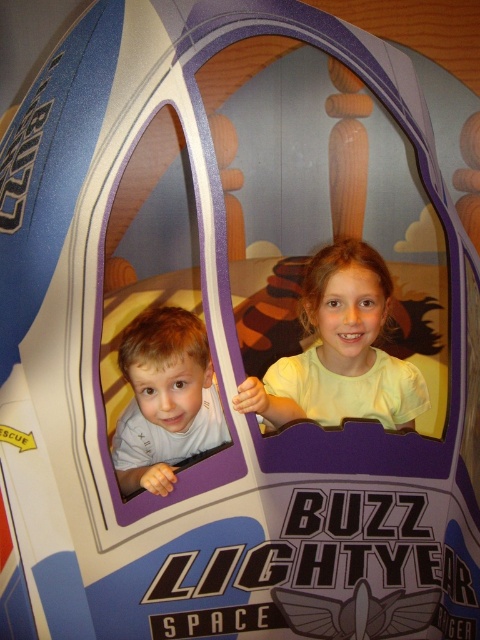
Is light yellow shirt at center below light brown hair at left?

Actually, light yellow shirt at center is above light brown hair at left.

Is light yellow shirt at center behind light brown hair at left?

Yes, it is.

Find the location of `light yellow shirt at center`. light yellow shirt at center is located at coordinates [x=339, y=352].